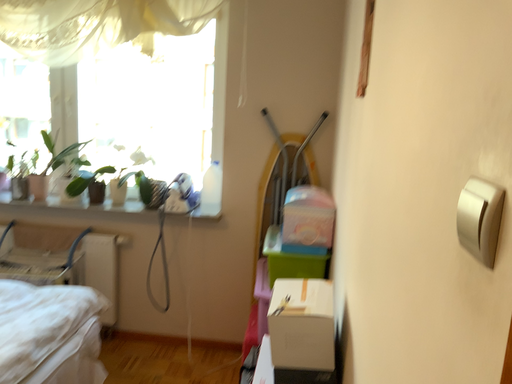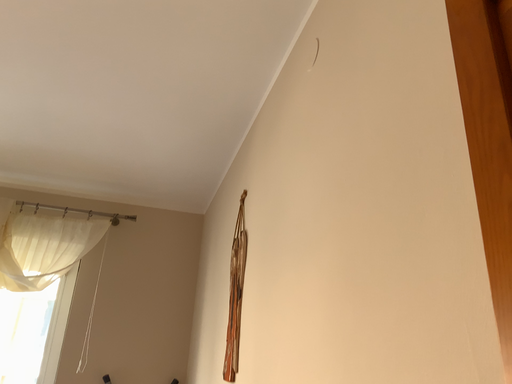
Question: Which way did the camera rotate in the video?

Choices:
 (A) rotated upward
 (B) rotated downward

Answer: (A)